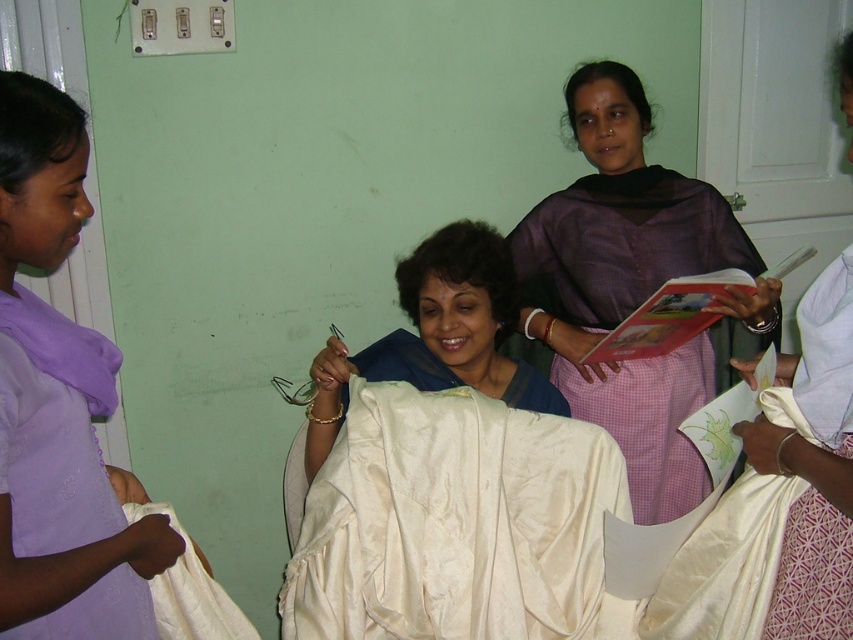
Who is positioned more to the left, purple silk saree at upper right or white satin cloth at right?

From the viewer's perspective, purple silk saree at upper right appears more on the left side.

Is purple silk saree at upper right behind white satin cloth at right?

Yes, it is.

Image resolution: width=853 pixels, height=640 pixels. I want to click on purple silk saree at upper right, so click(x=625, y=284).

Can you confirm if purple satin scarf at left is smaller than satin white saree at center?

Yes.

This screenshot has width=853, height=640. What do you see at coordinates (78, 568) in the screenshot?
I see `purple satin scarf at left` at bounding box center [78, 568].

This screenshot has height=640, width=853. In order to click on purple satin scarf at left in this screenshot , I will do `click(78, 568)`.

Does purple satin scarf at left have a lesser width compared to white satin cloth at right?

No, purple satin scarf at left is not thinner than white satin cloth at right.

The width and height of the screenshot is (853, 640). What do you see at coordinates (78, 568) in the screenshot? I see `purple satin scarf at left` at bounding box center [78, 568].

Find the location of `purple satin scarf at left`. purple satin scarf at left is located at coordinates (78, 568).

Locate an element on the screen. This screenshot has width=853, height=640. purple satin scarf at left is located at coordinates (78, 568).